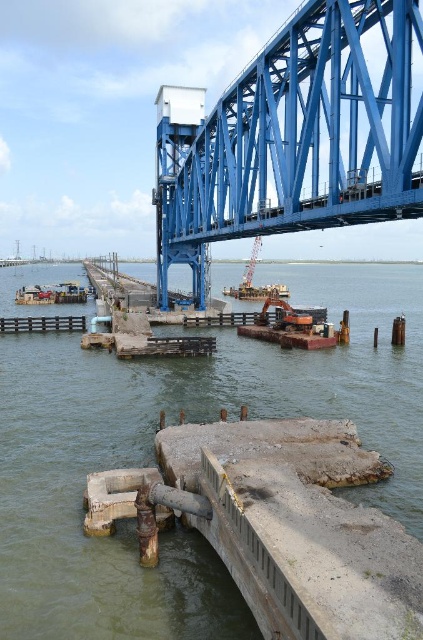
You are a construction worker standing at the edge of the gray concrete water at center. You need to move to the metallic gray crane at center to operate it. Is the path between them clear?

The gray concrete water at center is in front of the metallic gray crane at center, so the path between them is clear.

From the picture: You are an engineer inspecting the construction site. You need to determine if the blue metallic bridge at upper center is in a safe position relative to the metallic gray crane at center. Based on their positions, can the crane operate without interfering with the bridge?

The blue metallic bridge at upper center is positioned under the metallic gray crane at center, so the crane cannot operate safely without risking interference with the bridge. The crane should be repositioned to avoid contact.